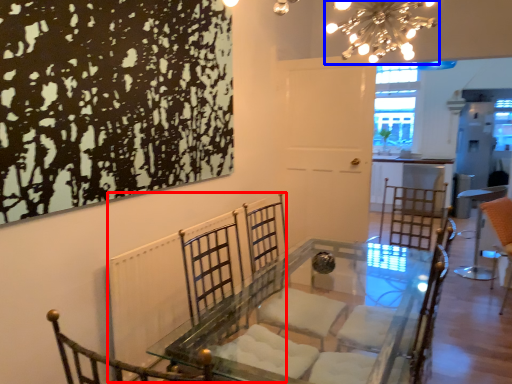
Question: Which object appears farthest to the camera in this image, radiator (highlighted by a red box) or light fixture (highlighted by a blue box)?

Choices:
 (A) radiator
 (B) light fixture

Answer: (B)